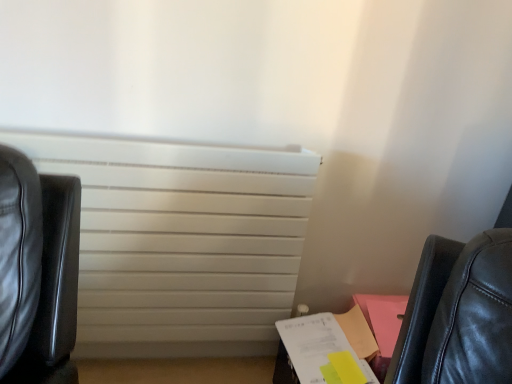
At what (x,y) coordinates should I click in order to perform the action: click on white matte radiator at center. Please return your answer as a coordinate pair (x, y). The height and width of the screenshot is (384, 512). Looking at the image, I should click on (181, 242).

Describe the element at coordinates (181, 242) in the screenshot. I see `white matte radiator at center` at that location.

Image resolution: width=512 pixels, height=384 pixels. What do you see at coordinates (317, 353) in the screenshot?
I see `white paper at lower right` at bounding box center [317, 353].

This screenshot has width=512, height=384. I want to click on white paper at lower right, so click(317, 353).

Find the location of a particular element. white matte radiator at center is located at coordinates (181, 242).

Is white paper at lower right at the right side of white matte radiator at center?

Indeed, white paper at lower right is positioned on the right side of white matte radiator at center.

In the image, is white paper at lower right positioned in front of or behind white matte radiator at center?

Clearly, white paper at lower right is behind white matte radiator at center.

Between point (276, 360) and point (283, 232), which one is positioned behind?

The point (276, 360) is more distant.

From the image's perspective, relative to white matte radiator at center, is white paper at lower right above or below?

Based on their image positions, white paper at lower right is located beneath white matte radiator at center.

From a real-world perspective, does white paper at lower right stand above white matte radiator at center?

No.

Considering the sizes of objects white paper at lower right and white matte radiator at center in the image provided, who is wider, white paper at lower right or white matte radiator at center?

white paper at lower right.

In terms of height, does white paper at lower right look taller or shorter compared to white matte radiator at center?

Clearly, white paper at lower right is shorter compared to white matte radiator at center.

Looking at the image, does white paper at lower right seem bigger or smaller compared to white matte radiator at center?

Considering their sizes, white paper at lower right takes up less space than white matte radiator at center.

Looking at this image, would you say white matte radiator at center is part of white paper at lower right's contents?

No, white matte radiator at center is located outside of white paper at lower right.

Looking at this image, is white paper at lower right far from white matte radiator at center?

Actually, white paper at lower right and white matte radiator at center are a little close together.

Is white paper at lower right positioned with its back to white matte radiator at center?

No.

Can you tell me how much white paper at lower right and white matte radiator at center differ in facing direction?

There is a 7.65-degree angle between the facing directions of white paper at lower right and white matte radiator at center.

Locate an element on the screen. This screenshot has width=512, height=384. radiator that is on the left side of white paper at lower right is located at coordinates (181, 242).

Based on the photo, is white matte radiator at center at the left side of white paper at lower right?

Indeed, white matte radiator at center is positioned on the left side of white paper at lower right.

Is white matte radiator at center positioned behind white paper at lower right?

No, white matte radiator at center is closer to the viewer.

Which is in front, point (281, 157) or point (361, 366)?

The point (361, 366) is closer to the camera.

From the image's perspective, which one is positioned higher, white matte radiator at center or white paper at lower right?

From the image's view, white matte radiator at center is above.

In the scene shown: From a real-world perspective, is white matte radiator at center below white paper at lower right?

No.

Considering the relative sizes of white matte radiator at center and white paper at lower right in the image provided, is white matte radiator at center wider than white paper at lower right?

Incorrect, the width of white matte radiator at center does not surpass that of white paper at lower right.

Does white matte radiator at center have a lesser height compared to white paper at lower right?

Incorrect, the height of white matte radiator at center does not fall short of that of white paper at lower right.

Between white matte radiator at center and white paper at lower right, which one has smaller size?

With smaller size is white paper at lower right.

Is white matte radiator at center positioned beyond the bounds of white paper at lower right?

Yes, white matte radiator at center is outside of white paper at lower right.

Is white matte radiator at center positioned far away from white paper at lower right?

Actually, white matte radiator at center and white paper at lower right are a little close together.

Is white matte radiator at center oriented towards white paper at lower right?

Yes.

Can you tell me how much white matte radiator at center and white paper at lower right differ in facing direction?

They differ by 7.65 degrees in their facing directions.

Find the location of a particular element. This screenshot has height=384, width=512. paperback book below the white matte radiator at center (from the image's perspective) is located at coordinates (317, 353).

Find the location of a particular element. radiator above the white paper at lower right (from a real-world perspective) is located at coordinates (181, 242).

Image resolution: width=512 pixels, height=384 pixels. I want to click on paperback book that appears behind the white matte radiator at center, so click(317, 353).